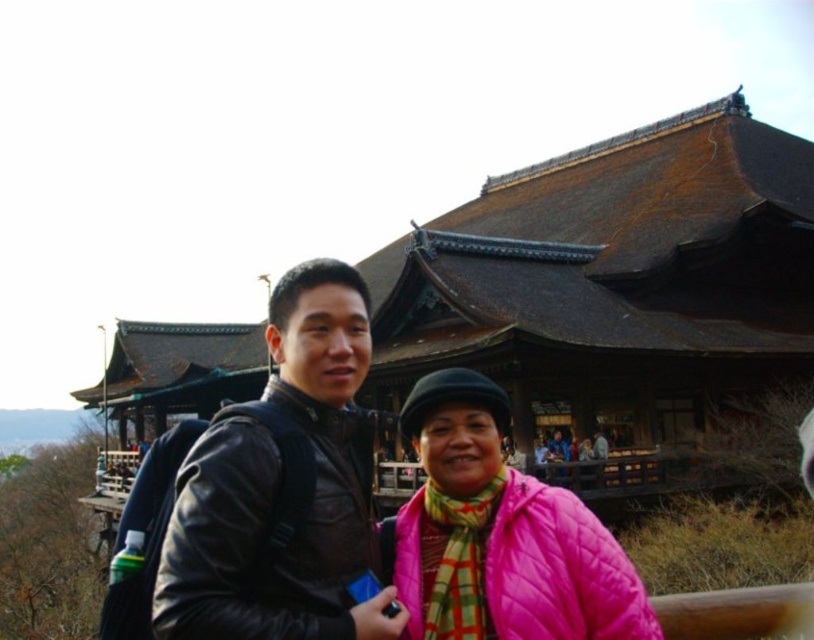
Question: Which is nearer to the pink quilted jacket at center?

Choices:
 (A) leather jacket at center
 (B) brown wooden palace at center

Answer: (A)

Question: Which point is closer to the camera?

Choices:
 (A) brown wooden palace at center
 (B) pink quilted jacket at center
 (C) leather jacket at center

Answer: (C)

Question: Observing the image, what is the correct spatial positioning of brown wooden palace at center in reference to pink quilted jacket at center?

Choices:
 (A) right
 (B) left

Answer: (B)

Question: Can you confirm if brown wooden palace at center is positioned to the left of leather jacket at center?

Choices:
 (A) no
 (B) yes

Answer: (B)

Question: Is brown wooden palace at center to the left of leather jacket at center from the viewer's perspective?

Choices:
 (A) yes
 (B) no

Answer: (A)

Question: Which of the following is the closest to the observer?

Choices:
 (A) (480, 392)
 (B) (156, 620)
 (C) (511, 192)

Answer: (B)